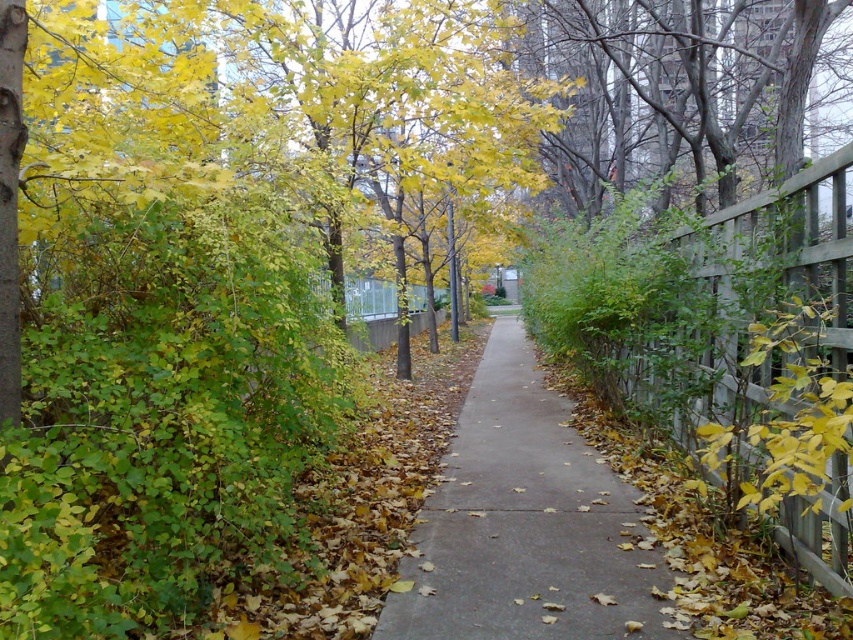
You are standing at the entrance of the pathway and want to walk to the gray concrete sidewalk at center. According to the coordinates provided, in which direction should you move relative to your current position?

You should move towards the point at coordinates (525, 524) to reach the gray concrete sidewalk at center.

You are a gardener who needs to place a 3 feet wide decorative stone on the gray concrete sidewalk at center. Considering the width of the wooden fence at right, will the stone fit on the sidewalk without overlapping the fence?

The gray concrete sidewalk at center is wider than the wooden fence at right. Since the sidewalk is wider, the 3 feet wide decorative stone should fit without overlapping the fence as long as it is placed appropriately within the sidewalk area.

You are standing at the point closer to the camera between the two points, point (457,493) and point (811,497). Which point are you standing at?

You are standing at point (457,493) because it is closer to the camera than point (811,497).